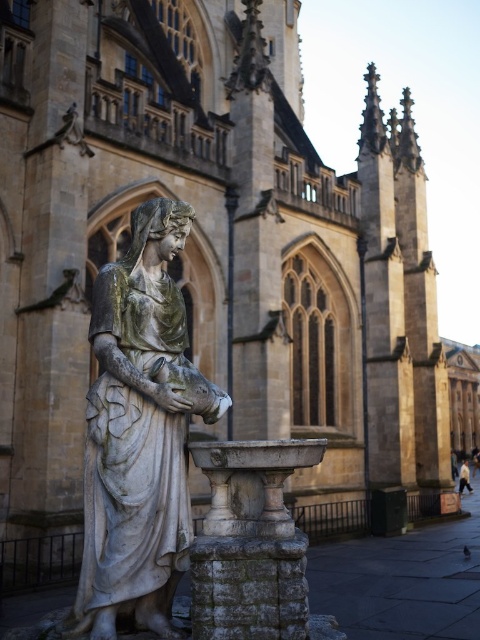
You are an artist preparing to sketch the scene. You notice two objects at the center of your view. Which object is narrower between the stone statue at center and the white cotton shirt at center?

The stone statue at center is thinner than the white cotton shirt at center, so the stone statue at center is narrower.

In the scene shown: You are a photographer planning to take a portrait of a person wearing a white cotton shirt at center. The stone statue at center is blocking your view. Can you suggest a way to position yourself so that the statue no longer obstructs the shirt?

The stone statue at center is taller than the white cotton shirt at center, so you can position yourself lower to avoid the obstruction caused by the statue.